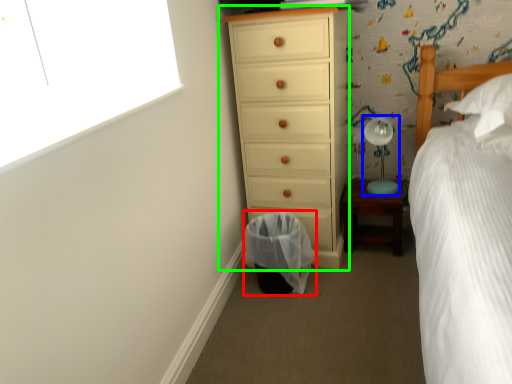
Question: Which object is positioned closest to laundry basket (highlighted by a red box)? Select from table lamp (highlighted by a blue box) and chest of drawers (highlighted by a green box).

Choices:
 (A) table lamp
 (B) chest of drawers

Answer: (B)